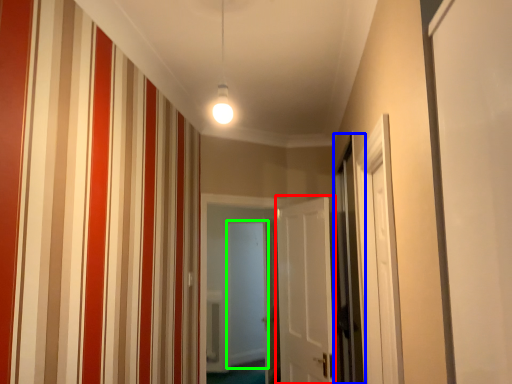
Question: Based on their relative distances, which object is farther from door (highlighted by a red box)? Choose from screen door (highlighted by a blue box) and screen door (highlighted by a green box).

Choices:
 (A) screen door
 (B) screen door

Answer: (B)